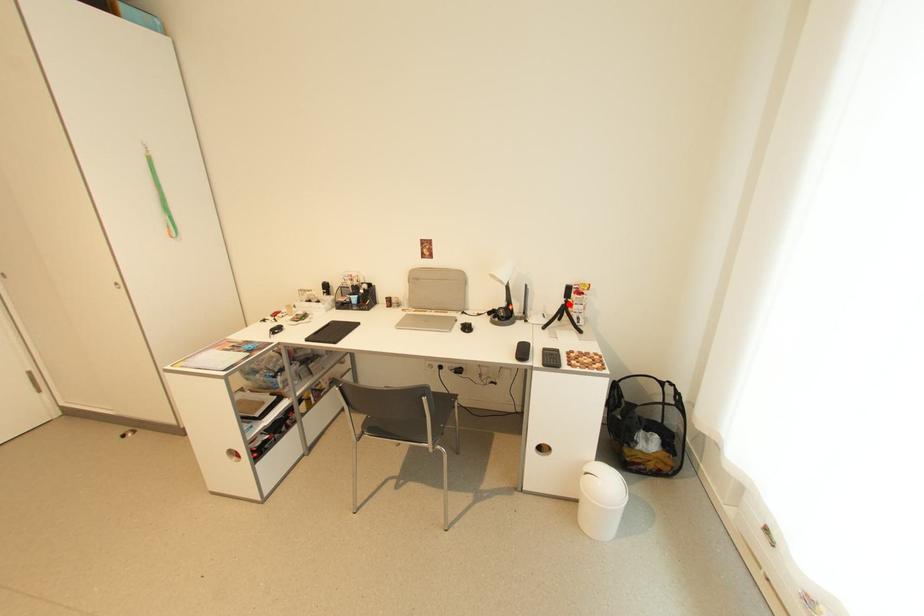
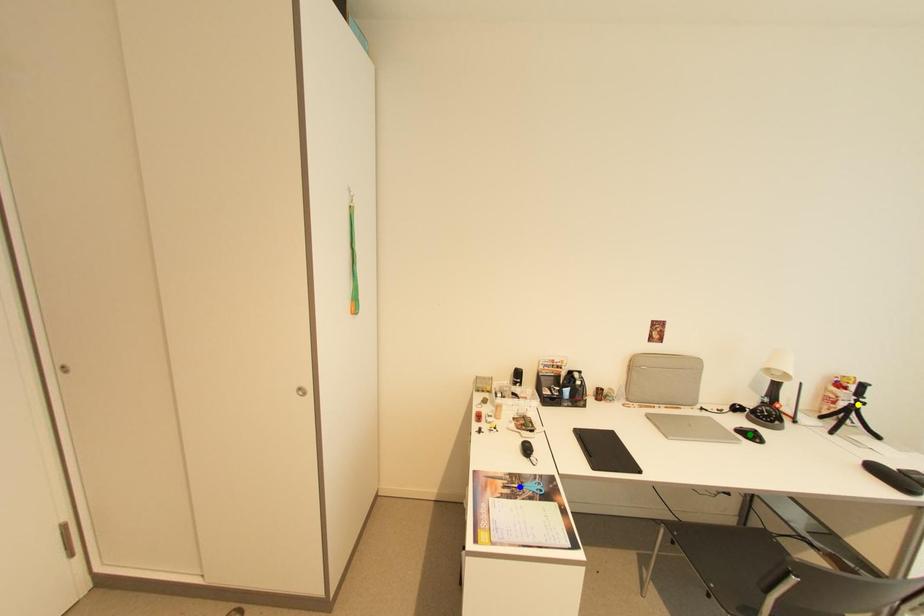
Question: I am providing you with two images of the same scene from different viewpoints. A red point is marked on the first image. You are given multiple points on the second image. Can you choose the point in image 2 that corresponds to the point in image 1?

Choices:
 (A) green point
 (B) yellow point
 (C) blue point

Answer: (B)